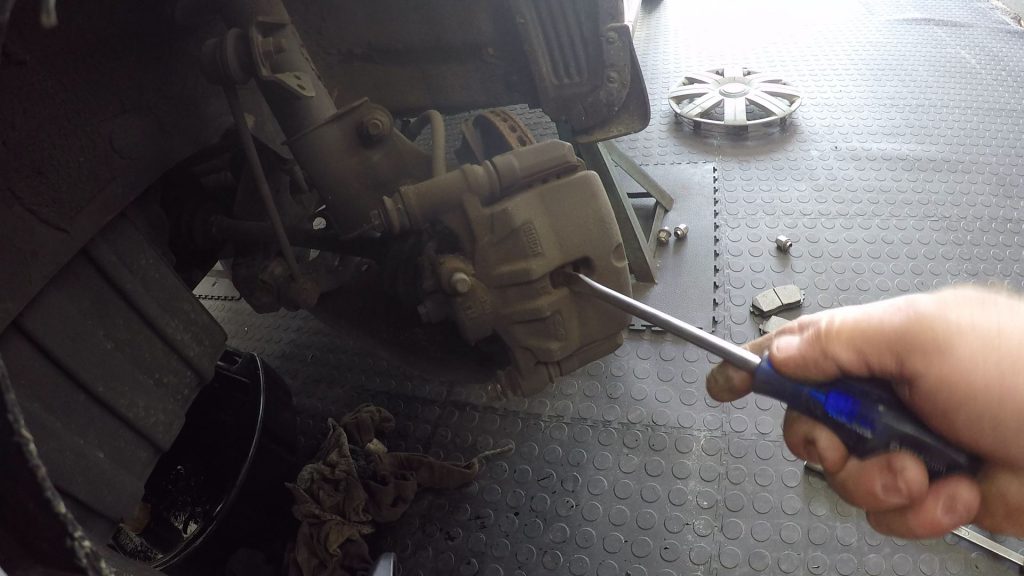
Locate an element on the screen. This screenshot has height=576, width=1024. rag is located at coordinates (370, 475).